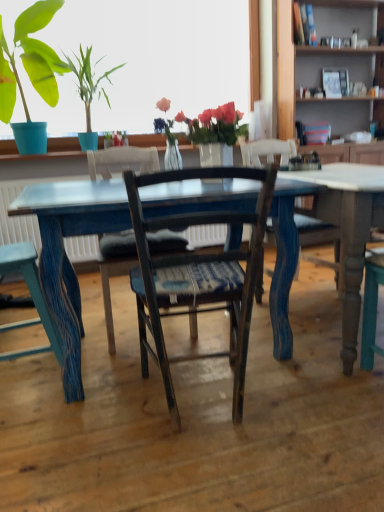
Question: Which direction should I rotate to look at wooden chair with woven seat cushion at center, arranged as the third chair when viewed from the left?

Choices:
 (A) left
 (B) right

Answer: (B)

Question: Is matte blue pot at upper left touching translucent glass vase at upper center?

Choices:
 (A) no
 (B) yes

Answer: (A)

Question: From a real-world perspective, is matte blue pot at upper left below translucent glass vase at upper center?

Choices:
 (A) yes
 (B) no

Answer: (B)

Question: Can you confirm if matte blue pot at upper left is bigger than translucent glass vase at upper center?

Choices:
 (A) yes
 (B) no

Answer: (A)

Question: Would you say matte blue pot at upper left is outside translucent glass vase at upper center?

Choices:
 (A) yes
 (B) no

Answer: (A)

Question: Is matte blue pot at upper left further to camera compared to translucent glass vase at upper center?

Choices:
 (A) yes
 (B) no

Answer: (A)

Question: Can you confirm if matte blue pot at upper left is taller than translucent glass vase at upper center?

Choices:
 (A) no
 (B) yes

Answer: (B)

Question: Is translucent glass vase at upper center bigger than blue painted wood table at center?

Choices:
 (A) yes
 (B) no

Answer: (B)

Question: Can you see translucent glass vase at upper center touching blue painted wood table at center?

Choices:
 (A) no
 (B) yes

Answer: (A)

Question: From a real-world perspective, does translucent glass vase at upper center stand above blue painted wood table at center?

Choices:
 (A) yes
 (B) no

Answer: (A)

Question: From the image's perspective, is translucent glass vase at upper center below blue painted wood table at center?

Choices:
 (A) no
 (B) yes

Answer: (A)

Question: Does translucent glass vase at upper center come behind blue painted wood table at center?

Choices:
 (A) no
 (B) yes

Answer: (B)

Question: Is translucent glass vase at upper center to the left of blue painted wood table at center from the viewer's perspective?

Choices:
 (A) no
 (B) yes

Answer: (B)

Question: Does distressed blue wood chair at lower left, the third chair from the right, have a greater width compared to wooden bookshelf at upper right?

Choices:
 (A) no
 (B) yes

Answer: (A)